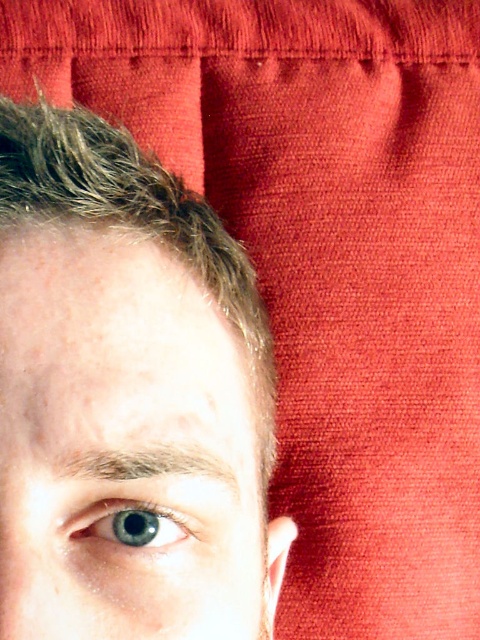
Question: Can you confirm if blue matte eye at center is positioned below blue glossy eye at center?

Choices:
 (A) yes
 (B) no

Answer: (B)

Question: Which object appears closest to the camera in this image?

Choices:
 (A) blue matte eye at center
 (B) blue glossy eye at center

Answer: (A)

Question: Can you confirm if blue matte eye at center is positioned above blue glossy eye at center?

Choices:
 (A) yes
 (B) no

Answer: (A)

Question: Can you confirm if blue matte eye at center is wider than blue glossy eye at center?

Choices:
 (A) yes
 (B) no

Answer: (A)